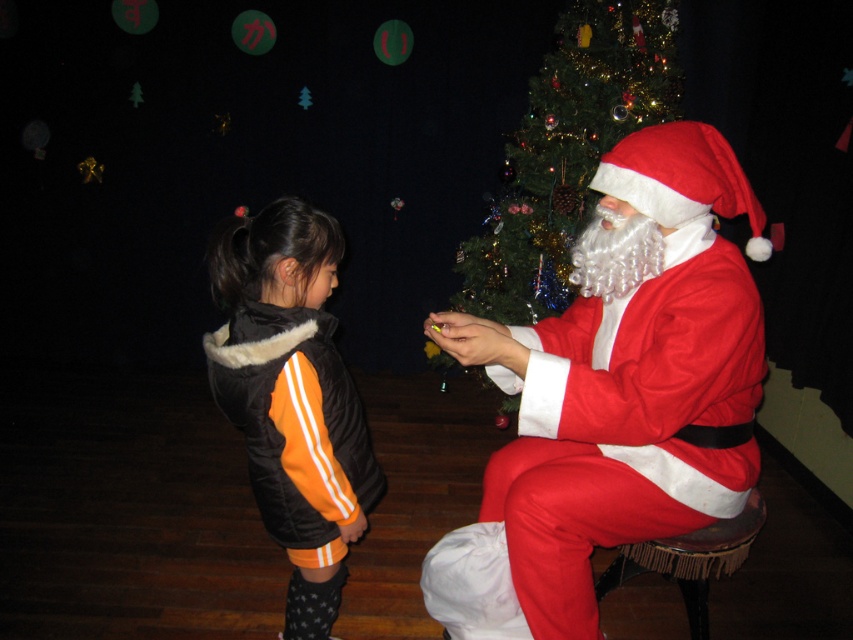
Question: Is velvet red santa at right smaller than velvet-like brown stool at lower right?

Choices:
 (A) no
 (B) yes

Answer: (A)

Question: Which object appears farthest from the camera in this image?

Choices:
 (A) green shiny christmas tree at upper center
 (B) velvet red santa at right
 (C) black fleece jacket at left
 (D) velvet-like brown stool at lower right

Answer: (A)

Question: Which object is positioned closest to the green shiny christmas tree at upper center?

Choices:
 (A) velvet-like brown stool at lower right
 (B) velvet red santa at right

Answer: (A)

Question: Is velvet red santa at right thinner than velvet-like brown stool at lower right?

Choices:
 (A) no
 (B) yes

Answer: (A)

Question: Is velvet red santa at right positioned at the back of velvet-like brown stool at lower right?

Choices:
 (A) yes
 (B) no

Answer: (B)

Question: Which object is positioned closest to the green shiny christmas tree at upper center?

Choices:
 (A) velvet red santa at right
 (B) velvet-like brown stool at lower right

Answer: (B)